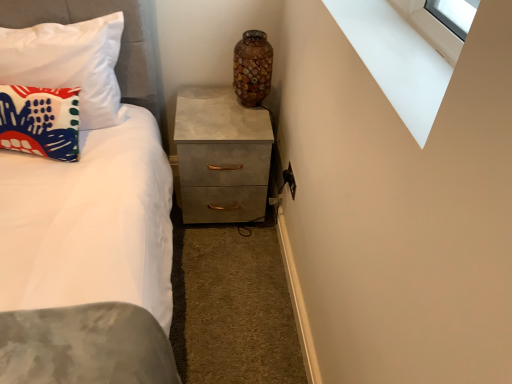
The width and height of the screenshot is (512, 384). Find the location of `free space in front of matte concrete chest of drawers at center`. free space in front of matte concrete chest of drawers at center is located at coordinates (223, 260).